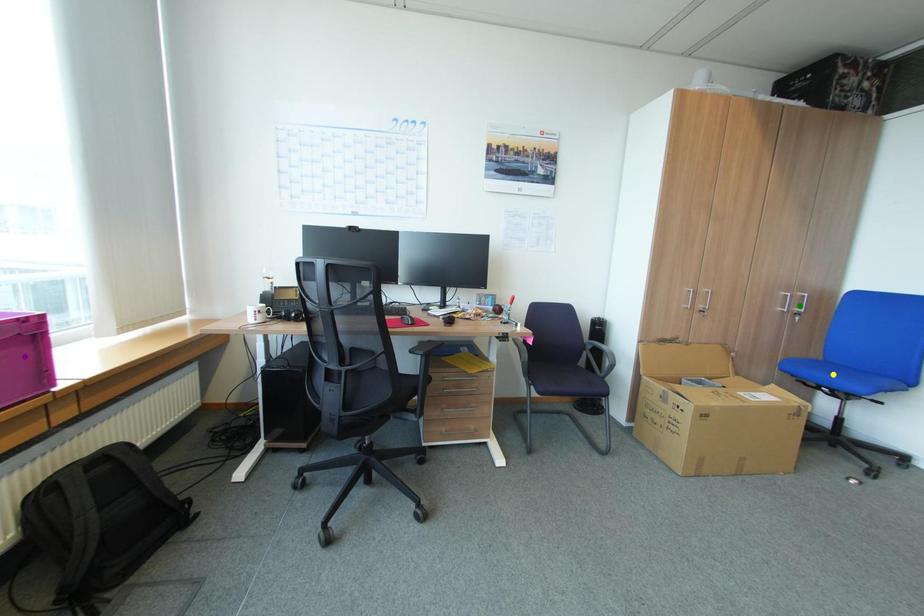
Order these from nearest to farthest:
green point, purple point, yellow point

purple point
yellow point
green point